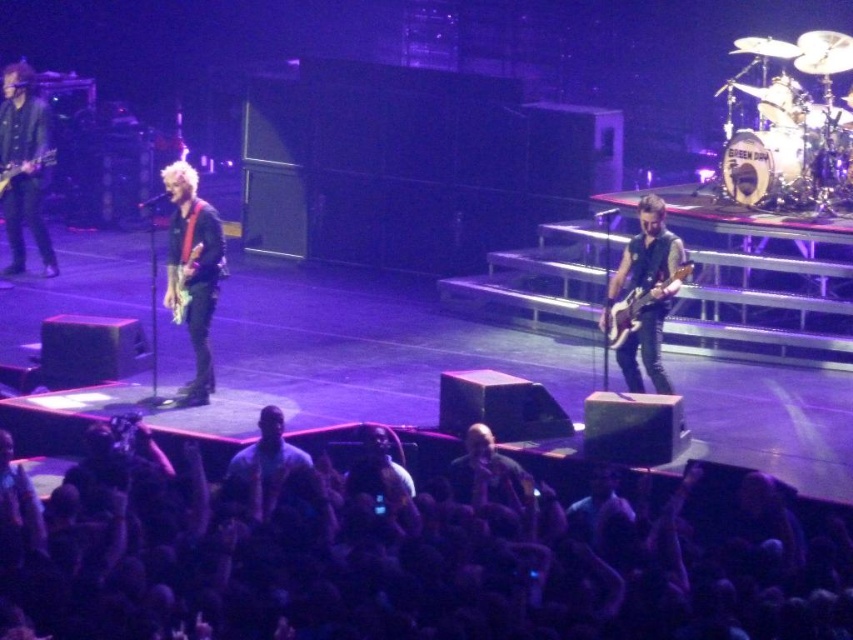
Question: Can you confirm if black fabric crowd at lower center is positioned to the right of matte black bass at center?

Choices:
 (A) no
 (B) yes

Answer: (A)

Question: Among these points, which one is farthest from the camera?

Choices:
 (A) (16, 173)
 (B) (622, 307)
 (C) (190, 253)

Answer: (A)

Question: Is black fabric crowd at lower center below matte black bass at center?

Choices:
 (A) no
 (B) yes

Answer: (B)

Question: Which object appears closest to the camera in this image?

Choices:
 (A) matte red electric guitar at left
 (B) glossy electric guitar at center

Answer: (B)

Question: Is matte black bass at center to the right of matte red electric guitar at left from the viewer's perspective?

Choices:
 (A) no
 (B) yes

Answer: (B)

Question: Estimate the real-world distances between objects in this image. Which object is farther from the matte red electric guitar at left?

Choices:
 (A) glossy electric guitar at center
 (B) matte black bass at center

Answer: (B)